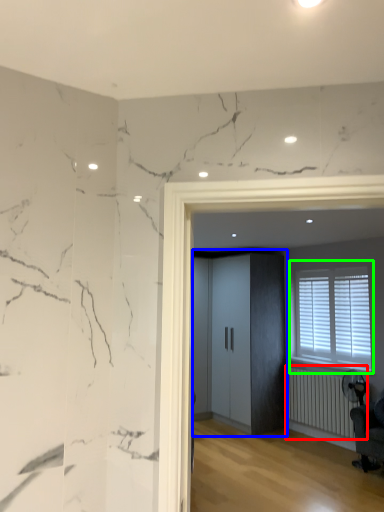
Question: Based on their relative distances, which object is nearer to radiator (highlighted by a red box)? Choose from elevator (highlighted by a blue box) and window (highlighted by a green box).

Choices:
 (A) elevator
 (B) window

Answer: (B)